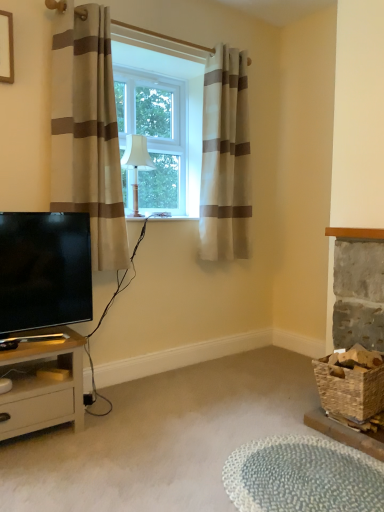
Question: From the image's perspective, is textured gray rug at lower center located above or below light beige wood nightstand at lower left?

Choices:
 (A) below
 (B) above

Answer: (A)

Question: From a real-world perspective, relative to light beige wood nightstand at lower left, is textured gray rug at lower center vertically above or below?

Choices:
 (A) below
 (B) above

Answer: (A)

Question: Which object is positioned farthest from the rustic woven basket at lower right?

Choices:
 (A) beige striped curtain at left, which is the 2th curtain from back to front
 (B) clear glass window at center
 (C) matte black tv at lower left
 (D) wooden picture frame at upper left
 (E) beige striped curtain at center, which is the first curtain from back to front

Answer: (D)

Question: Which of these objects is positioned closest to the textured gray rug at lower center?

Choices:
 (A) light beige wood nightstand at lower left
 (B) white fabric lampshade at center
 (C) clear glass window at center
 (D) rustic woven basket at lower right
 (E) beige striped curtain at left, which appears as the 1th curtain when viewed from the front

Answer: (D)